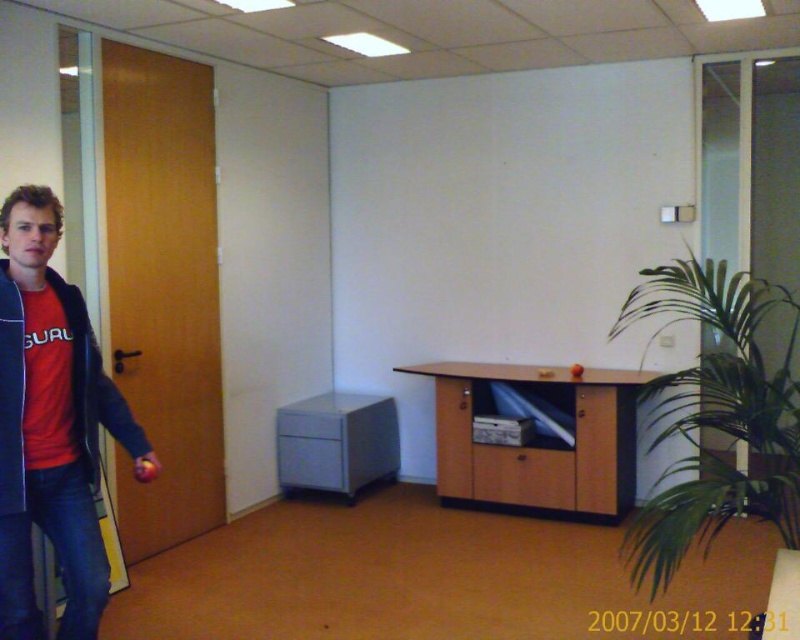
Is red cotton shirt at left below satin gray cabinet at center?

Actually, red cotton shirt at left is above satin gray cabinet at center.

Which is behind, point (14, 228) or point (382, 403)?

The point (382, 403) is behind.

I want to click on red cotton shirt at left, so click(50, 424).

Who is lower down, red cotton shirt at left or wooden cabinet at lower right?

wooden cabinet at lower right is below.

Which is more to the left, red cotton shirt at left or wooden cabinet at lower right?

Positioned to the left is red cotton shirt at left.

Find the location of a particular element. The height and width of the screenshot is (640, 800). red cotton shirt at left is located at coordinates (50, 424).

The image size is (800, 640). I want to click on red cotton shirt at left, so click(50, 424).

From the picture: Does wooden cabinet at lower right have a lesser height compared to satin gray cabinet at center?

In fact, wooden cabinet at lower right may be taller than satin gray cabinet at center.

Can you confirm if wooden cabinet at lower right is positioned below satin gray cabinet at center?

No, wooden cabinet at lower right is not below satin gray cabinet at center.

Who is more distant from viewer, (604, 403) or (298, 433)?

The point (298, 433) is more distant.

Find the location of `wooden cabinet at lower right`. wooden cabinet at lower right is located at coordinates (537, 438).